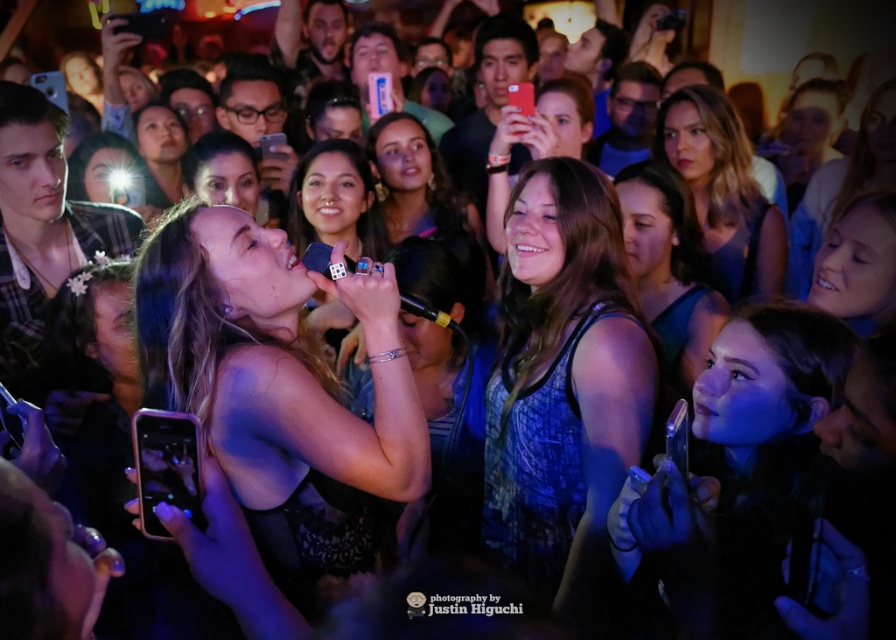
Where is `satin black microphone at center`? The image size is (896, 640). satin black microphone at center is located at coordinates (280, 394).

Is satin black microphone at center to the right of blonde hair at upper center from the viewer's perspective?

No, satin black microphone at center is not to the right of blonde hair at upper center.

Which is behind, point (343, 513) or point (769, 241)?

Positioned behind is point (769, 241).

This screenshot has width=896, height=640. What are the coordinates of `satin black microphone at center` in the screenshot? It's located at (280, 394).

Which is above, matte black tank top at center or blonde hair at upper center?

blonde hair at upper center

Is the position of matte black tank top at center more distant than that of blonde hair at upper center?

No, matte black tank top at center is in front of blonde hair at upper center.

Describe the element at coordinates (563, 381) in the screenshot. I see `matte black tank top at center` at that location.

The width and height of the screenshot is (896, 640). What are the coordinates of `matte black tank top at center` in the screenshot? It's located at (563, 381).

Between smooth black hair at center and matte skin tone face at center, which one appears on the left side from the viewer's perspective?

Positioned to the left is matte skin tone face at center.

Does smooth black hair at center lie behind matte skin tone face at center?

No, it is in front of matte skin tone face at center.

Which is behind, point (840, 340) or point (402, 221)?

The point (402, 221) is behind.

Find the location of a particular element. smooth black hair at center is located at coordinates (737, 474).